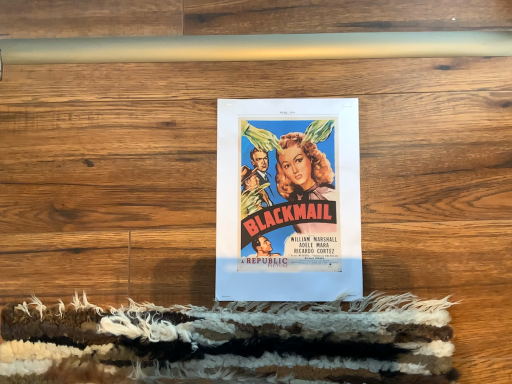
Measure the distance between point (261, 217) and camera.

The depth of point (261, 217) is 24.37 inches.

At what (x,y) coordinates should I click in order to perform the action: click on matte paper poster at center. Please return your answer as a coordinate pair (x, y). The image size is (512, 384). Looking at the image, I should click on (288, 200).

Describe the element at coordinates (288, 200) in the screenshot. The width and height of the screenshot is (512, 384). I see `matte paper poster at center` at that location.

Identify the location of matte paper poster at center. Image resolution: width=512 pixels, height=384 pixels. (288, 200).